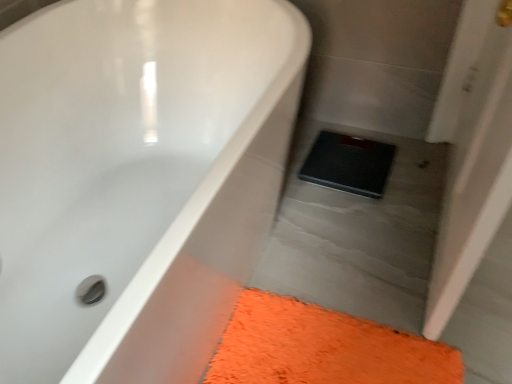
Question: From the image's perspective, is orange shaggy bath mat at lower right on top of black rubber scale at center?

Choices:
 (A) no
 (B) yes

Answer: (A)

Question: Can you confirm if orange shaggy bath mat at lower right is shorter than black rubber scale at center?

Choices:
 (A) yes
 (B) no

Answer: (A)

Question: Considering the relative sizes of orange shaggy bath mat at lower right and black rubber scale at center in the image provided, is orange shaggy bath mat at lower right taller than black rubber scale at center?

Choices:
 (A) yes
 (B) no

Answer: (B)

Question: Can you confirm if orange shaggy bath mat at lower right is positioned to the right of black rubber scale at center?

Choices:
 (A) no
 (B) yes

Answer: (A)

Question: Considering the relative positions of orange shaggy bath mat at lower right and black rubber scale at center in the image provided, is orange shaggy bath mat at lower right to the left of black rubber scale at center from the viewer's perspective?

Choices:
 (A) no
 (B) yes

Answer: (B)

Question: Are orange shaggy bath mat at lower right and black rubber scale at center located far from each other?

Choices:
 (A) no
 (B) yes

Answer: (A)

Question: Is white glossy bathtub at upper left oriented away from orange shaggy bath mat at lower right?

Choices:
 (A) no
 (B) yes

Answer: (A)

Question: Does white glossy bathtub at upper left have a smaller size compared to orange shaggy bath mat at lower right?

Choices:
 (A) yes
 (B) no

Answer: (B)

Question: Could you tell me if white glossy bathtub at upper left is facing orange shaggy bath mat at lower right?

Choices:
 (A) no
 (B) yes

Answer: (B)

Question: From a real-world perspective, is white glossy bathtub at upper left located beneath orange shaggy bath mat at lower right?

Choices:
 (A) no
 (B) yes

Answer: (A)

Question: Is white glossy bathtub at upper left outside of orange shaggy bath mat at lower right?

Choices:
 (A) yes
 (B) no

Answer: (A)

Question: From the image's perspective, would you say white glossy bathtub at upper left is positioned over orange shaggy bath mat at lower right?

Choices:
 (A) no
 (B) yes

Answer: (B)

Question: Is the position of orange shaggy bath mat at lower right more distant than that of white glossy bathtub at upper left?

Choices:
 (A) no
 (B) yes

Answer: (B)